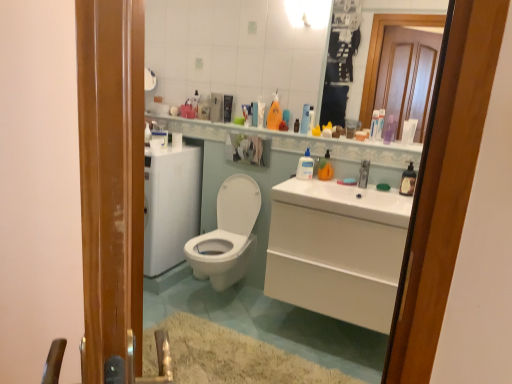
Image resolution: width=512 pixels, height=384 pixels. What are the coordinates of `free location to the right of clear plastic bottle at center, the second cleaning product when ordered from left to right` in the screenshot? It's located at (326, 181).